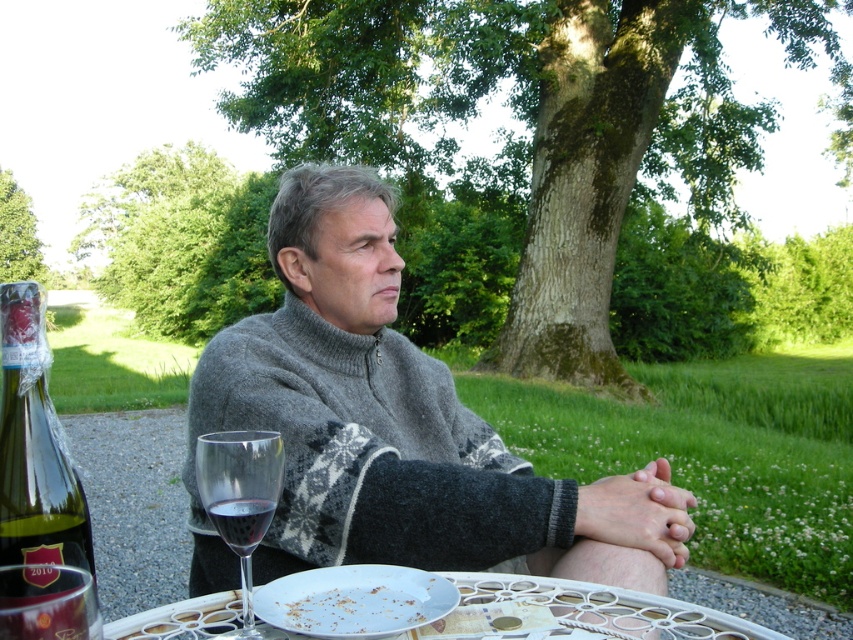
Can you confirm if white plastic plate at lower center is wider than white porcelain plate at lower center?

Indeed, white plastic plate at lower center has a greater width compared to white porcelain plate at lower center.

Looking at this image, between white plastic plate at lower center and white porcelain plate at lower center, which one has less height?

With less height is white porcelain plate at lower center.

Where is `white plastic plate at lower center`? The image size is (853, 640). white plastic plate at lower center is located at coordinates (575, 612).

Image resolution: width=853 pixels, height=640 pixels. I want to click on white plastic plate at lower center, so click(x=575, y=612).

Between white plastic plate at lower center and translucent glass at table center, which one has less height?

translucent glass at table center

Can you confirm if white plastic plate at lower center is positioned to the left of translucent glass at table center?

Incorrect, white plastic plate at lower center is not on the left side of translucent glass at table center.

Identify the location of white plastic plate at lower center. This screenshot has height=640, width=853. (575, 612).

What are the coordinates of `white plastic plate at lower center` in the screenshot? It's located at (575, 612).

Does gray wool sweater at center appear over white porcelain plate at lower center?

Indeed, gray wool sweater at center is positioned over white porcelain plate at lower center.

Who is more distant from viewer, (305, 163) or (442, 579)?

Positioned behind is point (305, 163).

I want to click on gray wool sweater at center, so click(x=393, y=428).